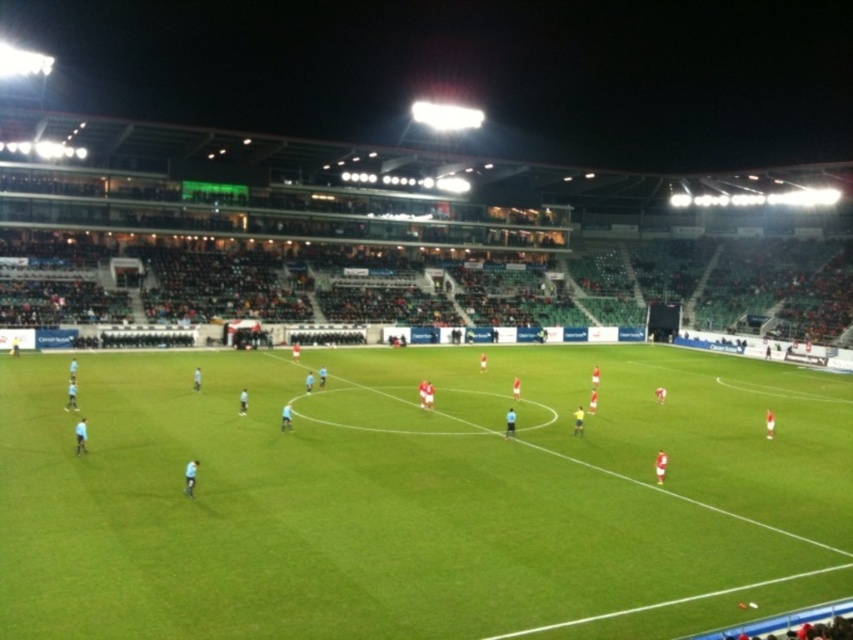
The height and width of the screenshot is (640, 853). What do you see at coordinates (418, 496) in the screenshot?
I see `green grass football field at center` at bounding box center [418, 496].

Between point (90, 445) and point (498, 529), which one is positioned in front?

Point (498, 529) is more forward.

Between point (672, 387) and point (845, 403), which one is positioned in front?

Point (845, 403) is in front.

Where is `green grass football field at center`? green grass football field at center is located at coordinates (418, 496).